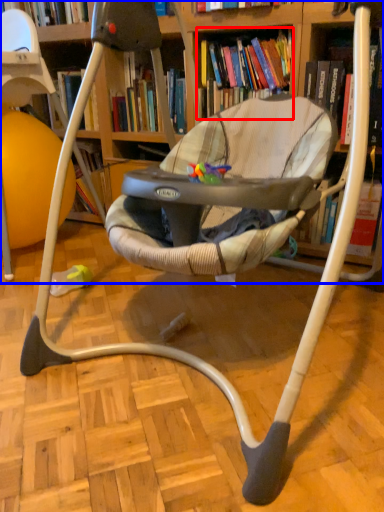
Question: Which object is further to the camera taking this photo, book (highlighted by a red box) or bookcase (highlighted by a blue box)?

Choices:
 (A) book
 (B) bookcase

Answer: (A)